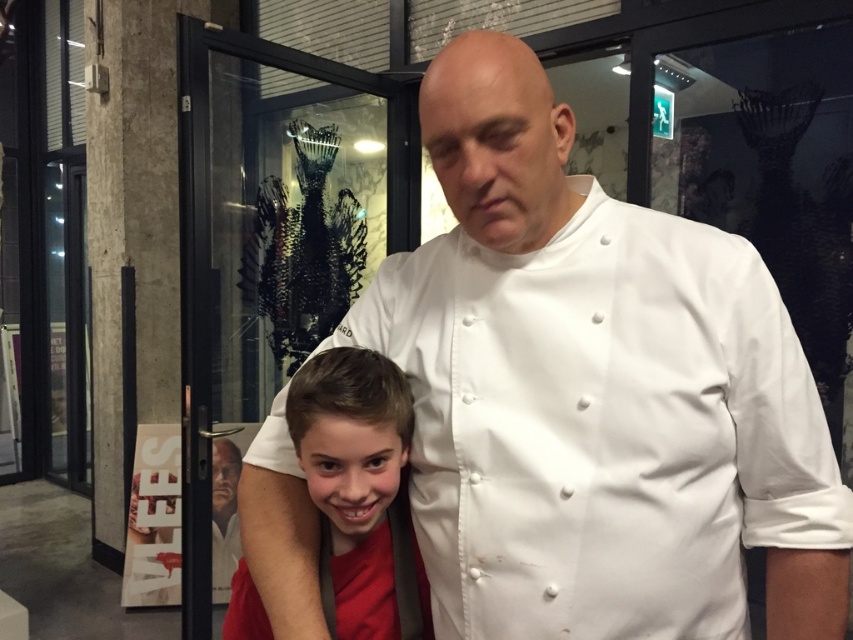
Question: Which of the following is the closest to the observer?

Choices:
 (A) red matte shirt at lower left
 (B) white matte chef coat at center

Answer: (B)

Question: Does white matte chef coat at center have a smaller size compared to red matte shirt at lower left?

Choices:
 (A) yes
 (B) no

Answer: (B)

Question: Among these points, which one is nearest to the camera?

Choices:
 (A) (744, 504)
 (B) (345, 573)

Answer: (A)

Question: Is white matte chef coat at center smaller than red matte shirt at lower left?

Choices:
 (A) no
 (B) yes

Answer: (A)

Question: Among these points, which one is farthest from the camera?

Choices:
 (A) coord(668,240)
 (B) coord(309,435)

Answer: (A)

Question: In this image, where is white matte chef coat at center located relative to red matte shirt at lower left?

Choices:
 (A) below
 (B) above

Answer: (B)